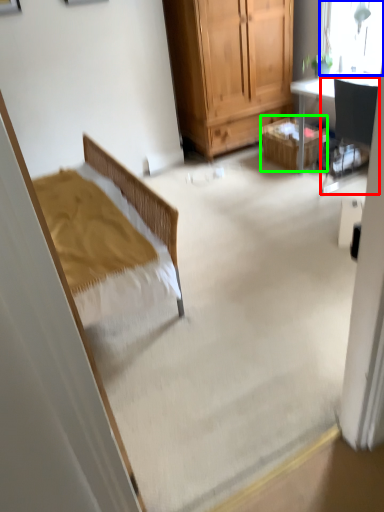
Question: Which object is the farthest from chair (highlighted by a red box)? Choose among these: window (highlighted by a blue box) or picnic basket (highlighted by a green box).

Choices:
 (A) window
 (B) picnic basket

Answer: (B)